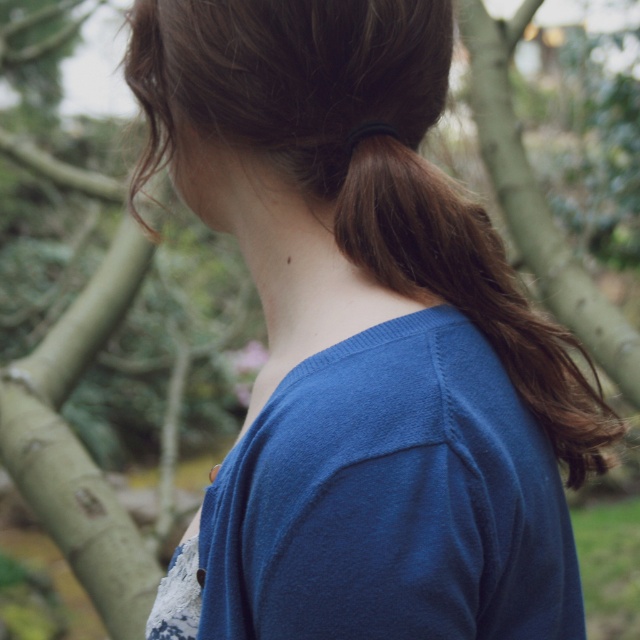
Question: Observing the image, what is the correct spatial positioning of blue cotton shirt at center in reference to brown silky hair at upper right?

Choices:
 (A) above
 (B) below

Answer: (B)

Question: Is blue cotton shirt at center below brown silky hair at upper right?

Choices:
 (A) yes
 (B) no

Answer: (A)

Question: Is blue cotton shirt at center bigger than brown silky hair at upper right?

Choices:
 (A) no
 (B) yes

Answer: (B)

Question: Among these objects, which one is farthest from the camera?

Choices:
 (A) brown silky hair at upper right
 (B) blue cotton shirt at center

Answer: (A)